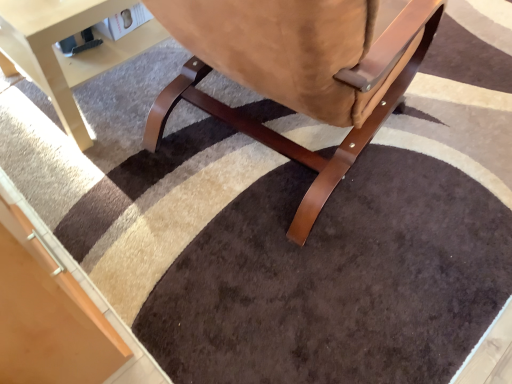
Question: From the image's perspective, relative to light beige wood table at lower left, is suede-like brown chair at center above or below?

Choices:
 (A) above
 (B) below

Answer: (B)

Question: Is suede-like brown chair at center bigger or smaller than light beige wood table at lower left?

Choices:
 (A) small
 (B) big

Answer: (B)

Question: Considering their positions, is suede-like brown chair at center located in front of or behind light beige wood table at lower left?

Choices:
 (A) front
 (B) behind

Answer: (A)

Question: From a real-world perspective, is light beige wood table at lower left above or below suede-like brown chair at center?

Choices:
 (A) below
 (B) above

Answer: (A)

Question: Looking at the image, does light beige wood table at lower left seem bigger or smaller compared to suede-like brown chair at center?

Choices:
 (A) small
 (B) big

Answer: (A)

Question: Based on their positions, is light beige wood table at lower left located to the left or right of suede-like brown chair at center?

Choices:
 (A) left
 (B) right

Answer: (A)

Question: In terms of height, does light beige wood table at lower left look taller or shorter compared to suede-like brown chair at center?

Choices:
 (A) tall
 (B) short

Answer: (B)